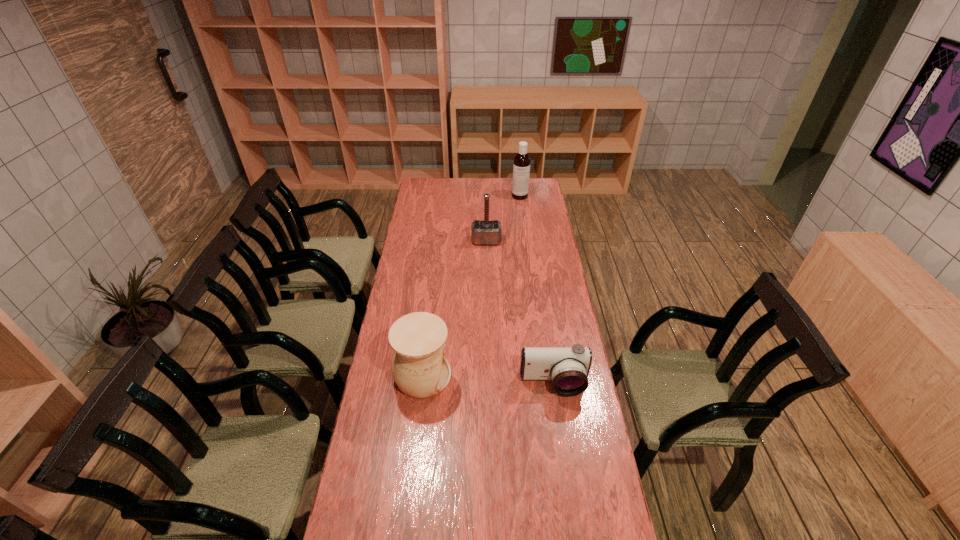
This screenshot has width=960, height=540. I want to click on vacant position located on the surface of the shortest object, so pyautogui.click(x=565, y=467).

The width and height of the screenshot is (960, 540). In order to click on object that is at the far edge in this screenshot , I will do `click(521, 168)`.

The image size is (960, 540). What are the coordinates of `object that is at the left edge` in the screenshot? It's located at coord(420,368).

Identify the location of dishwasher detergent present at the right edge. (521, 168).

This screenshot has width=960, height=540. Identify the location of camcorder that is at the right edge. (568, 367).

At what (x,y) coordinates should I click in order to perform the action: click on object that is at the far right corner. Please return your answer as a coordinate pair (x, y). The image size is (960, 540). Looking at the image, I should click on (521, 168).

The height and width of the screenshot is (540, 960). In the image, there is a desktop. What are the coordinates of `free space at the far edge` in the screenshot? It's located at (503, 197).

Identify the location of free space at the right edge of the desktop. This screenshot has width=960, height=540. (540, 247).

At what (x,y) coordinates should I click in order to perform the action: click on free spot between the dishwasher detergent and the shortest object. Please return your answer as a coordinate pair (x, y). This screenshot has width=960, height=540. Looking at the image, I should click on (537, 290).

Where is `blank region between the pottery and the camcorder`? blank region between the pottery and the camcorder is located at coordinates (488, 380).